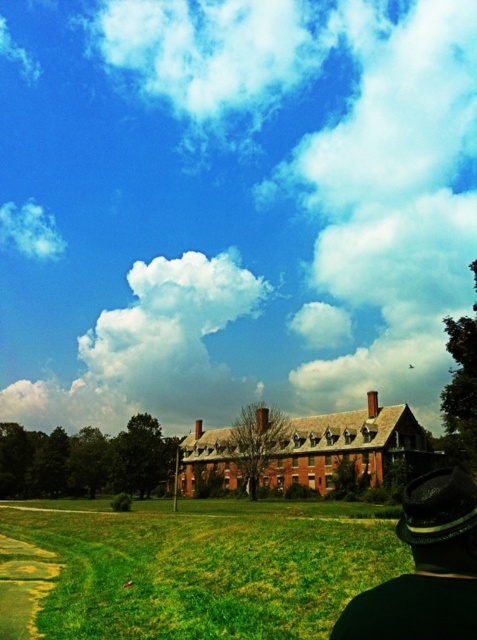
You are standing in the grassy area in front of the historic brick building. You see the black felt hat at lower right and the white fluffy cloud at upper left. Which object is nearer to you?

The black felt hat at lower right is closer to the viewer than the white fluffy cloud at upper left.

You are standing in the outdoor scene and want to take a photo of the historic brick building. To ensure the green grass at lower center and white fluffy cloud at upper left are both visible in your shot, where should you position yourself relative to the building?

You should position yourself in front of the historic brick building so that the green grass at lower center, which is in front of the white fluffy cloud at upper left, can be seen along with the building in the background.